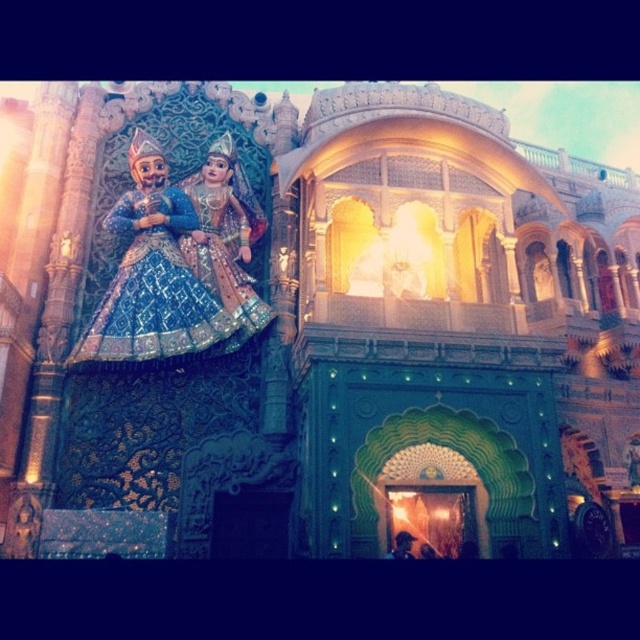
You are an architect examining the grand Indian building. You notice the green carved wood palace at upper center and the shiny blue fabric dress at upper left. Which object is positioned higher in the image?

The green carved wood palace at upper center is located above the shiny blue fabric dress at upper left, so it is positioned higher in the image.